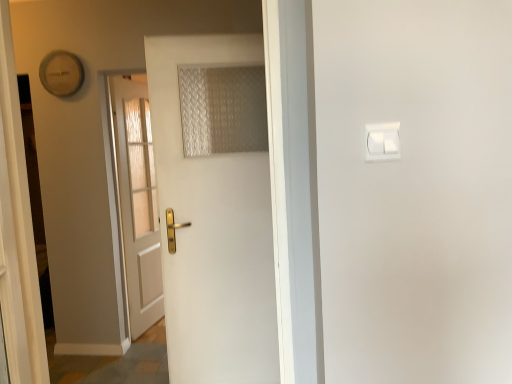
Identify the location of white wooden door at center, marked as the 2th door in a front-to-back arrangement. The width and height of the screenshot is (512, 384). (136, 201).

What do you see at coordinates (136, 201) in the screenshot? This screenshot has height=384, width=512. I see `white wooden door at center, the first door in the left-to-right sequence` at bounding box center [136, 201].

From the picture: In order to face wooden clock at upper left, should I rotate leftwards or rightwards?

Turn left by 24.149 degrees to look at wooden clock at upper left.

The image size is (512, 384). Describe the element at coordinates (213, 232) in the screenshot. I see `white matte door at center, placed as the second door when sorted from left to right` at that location.

Image resolution: width=512 pixels, height=384 pixels. In order to click on white matte door at center, placed as the 1th door when sorted from front to back in this screenshot , I will do `click(213, 232)`.

What do you see at coordinates (222, 109) in the screenshot? I see `translucent fabric curtain at center` at bounding box center [222, 109].

Where is `translucent fabric curtain at center`? The image size is (512, 384). translucent fabric curtain at center is located at coordinates (222, 109).

Identify the location of white wooden door at center, the first door in the left-to-right sequence. The image size is (512, 384). (136, 201).

Which is farther, (80,86) or (135,207)?

Point (135,207)

Is wooden clock at upper left situated inside white wooden door at center, which ranks as the 2th door in right-to-left order, or outside?

wooden clock at upper left is not inside white wooden door at center, which ranks as the 2th door in right-to-left order, it's outside.

From the image's perspective, is wooden clock at upper left above or below white wooden door at center, the first door in the left-to-right sequence?

Clearly, from the image's perspective, wooden clock at upper left is above white wooden door at center, the first door in the left-to-right sequence.

Which is further, [153,207] or [196,153]?

The point [153,207] is more distant.

Is white wooden door at center, marked as the 2th door in a front-to-back arrangement, in front of or behind translucent fabric curtain at center in the image?

In the image, white wooden door at center, marked as the 2th door in a front-to-back arrangement, appears behind translucent fabric curtain at center.

Consider the image. Can you confirm if white wooden door at center, marked as the 2th door in a front-to-back arrangement, is positioned to the right of translucent fabric curtain at center?

In fact, white wooden door at center, marked as the 2th door in a front-to-back arrangement, is to the left of translucent fabric curtain at center.

Where is `curtain that appears above the white wooden door at center, the 1th door viewed from the back (from the image's perspective)`? Image resolution: width=512 pixels, height=384 pixels. curtain that appears above the white wooden door at center, the 1th door viewed from the back (from the image's perspective) is located at coordinates (222, 109).

Is translucent fabric curtain at center behind wooden clock at upper left?

No, translucent fabric curtain at center is closer to the viewer.

Is translucent fabric curtain at center positioned beyond the bounds of wooden clock at upper left?

translucent fabric curtain at center lies outside wooden clock at upper left's area.

Which object is positioned more to the right, translucent fabric curtain at center or wooden clock at upper left?

translucent fabric curtain at center.

Is white wooden door at center, which ranks as the 2th door in right-to-left order, positioned before wooden clock at upper left?

No, it is not.

From a real-world perspective, is white wooden door at center, the 1th door viewed from the back, above or below wooden clock at upper left?

In terms of real-world spatial position, white wooden door at center, the 1th door viewed from the back, is below wooden clock at upper left.

Does white wooden door at center, the 1th door viewed from the back, turn towards wooden clock at upper left?

No, white wooden door at center, the 1th door viewed from the back, is not facing towards wooden clock at upper left.

Looking at this image, how many degrees apart are the facing directions of white wooden door at center, which ranks as the 2th door in right-to-left order, and wooden clock at upper left?

80.3 degrees.

Does white matte door at center, placed as the 1th door when sorted from front to back, touch white wooden door at center, the 1th door viewed from the back?

They are not placed beside each other.

Is white matte door at center, placed as the 1th door when sorted from front to back, in front of or behind white wooden door at center, the first door in the left-to-right sequence, in the image?

Clearly, white matte door at center, placed as the 1th door when sorted from front to back, is in front of white wooden door at center, the first door in the left-to-right sequence.

From the image's perspective, is white matte door at center, placed as the second door when sorted from left to right, above or below white wooden door at center, the first door in the left-to-right sequence?

Based on their image positions, white matte door at center, placed as the second door when sorted from left to right, is located beneath white wooden door at center, the first door in the left-to-right sequence.

How different are the orientations of white matte door at center, placed as the 1th door when sorted from front to back, and white wooden door at center, the 1th door viewed from the back, in degrees?

70.8 degrees separate the facing orientations of white matte door at center, placed as the 1th door when sorted from front to back, and white wooden door at center, the 1th door viewed from the back.

Considering the sizes of objects wooden clock at upper left and white matte door at center, which is the second door in back-to-front order, in the image provided, who is thinner, wooden clock at upper left or white matte door at center, which is the second door in back-to-front order,?

With smaller width is wooden clock at upper left.

From the image's perspective, is wooden clock at upper left positioned above or below white matte door at center, arranged as the first door when viewed from the right?

Based on their image positions, wooden clock at upper left is located above white matte door at center, arranged as the first door when viewed from the right.

How far apart are wooden clock at upper left and white matte door at center, placed as the second door when sorted from left to right?

A distance of 1.40 meters exists between wooden clock at upper left and white matte door at center, placed as the second door when sorted from left to right.

Is white matte door at center, placed as the second door when sorted from left to right, inside wooden clock at upper left?

No, white matte door at center, placed as the second door when sorted from left to right, is not surrounded by wooden clock at upper left.

Does white matte door at center, which is the second door in back-to-front order, appear on the right side of translucent fabric curtain at center?

Incorrect, white matte door at center, which is the second door in back-to-front order, is not on the right side of translucent fabric curtain at center.

Measure the distance from white matte door at center, placed as the second door when sorted from left to right, to translucent fabric curtain at center.

white matte door at center, placed as the second door when sorted from left to right, and translucent fabric curtain at center are 10.61 inches apart.

In terms of size, does white matte door at center, placed as the second door when sorted from left to right, appear bigger or smaller than translucent fabric curtain at center?

Clearly, white matte door at center, placed as the second door when sorted from left to right, is larger in size than translucent fabric curtain at center.

Where is `clock in front of the white wooden door at center, the first door in the left-to-right sequence`? clock in front of the white wooden door at center, the first door in the left-to-right sequence is located at coordinates (61, 73).

The width and height of the screenshot is (512, 384). I want to click on door that is the 2nd one below the translucent fabric curtain at center (from a real-world perspective), so click(x=136, y=201).

Based on their spatial positions, is white matte door at center, which is the second door in back-to-front order, or translucent fabric curtain at center further from white wooden door at center, the first door in the left-to-right sequence?

translucent fabric curtain at center is further to white wooden door at center, the first door in the left-to-right sequence.

From the image, which object appears to be nearer to white matte door at center, arranged as the first door when viewed from the right, white wooden door at center, marked as the 2th door in a front-to-back arrangement, or translucent fabric curtain at center?

Based on the image, translucent fabric curtain at center appears to be nearer to white matte door at center, arranged as the first door when viewed from the right.

In the scene shown: When comparing their distances from wooden clock at upper left, does white matte door at center, arranged as the first door when viewed from the right, or white wooden door at center, the first door in the left-to-right sequence, seem further?

white matte door at center, arranged as the first door when viewed from the right, is further to wooden clock at upper left.

When comparing their distances from wooden clock at upper left, does translucent fabric curtain at center or white matte door at center, arranged as the first door when viewed from the right, seem closer?

translucent fabric curtain at center lies closer to wooden clock at upper left than the other object.

When comparing their distances from wooden clock at upper left, does white wooden door at center, the 1th door viewed from the back, or white matte door at center, placed as the second door when sorted from left to right, seem further?

white matte door at center, placed as the second door when sorted from left to right, is positioned further to the anchor wooden clock at upper left.

Based on the photo, looking at the image, which one is located closer to white wooden door at center, which ranks as the 2th door in right-to-left order, translucent fabric curtain at center or wooden clock at upper left?

wooden clock at upper left is closer to white wooden door at center, which ranks as the 2th door in right-to-left order.

Based on their spatial positions, is white wooden door at center, which ranks as the 2th door in right-to-left order, or white matte door at center, which is the second door in back-to-front order, closer to translucent fabric curtain at center?

white matte door at center, which is the second door in back-to-front order, is positioned closer to the anchor translucent fabric curtain at center.

From the image, which object appears to be nearer to wooden clock at upper left, translucent fabric curtain at center or white wooden door at center, marked as the 2th door in a front-to-back arrangement?

Based on the image, white wooden door at center, marked as the 2th door in a front-to-back arrangement, appears to be nearer to wooden clock at upper left.

I want to click on curtain positioned between white matte door at center, placed as the 1th door when sorted from front to back, and white wooden door at center, marked as the 2th door in a front-to-back arrangement, from near to far, so click(222, 109).

This screenshot has width=512, height=384. Identify the location of door between wooden clock at upper left and white matte door at center, which is the second door in back-to-front order, from left to right. (136, 201).